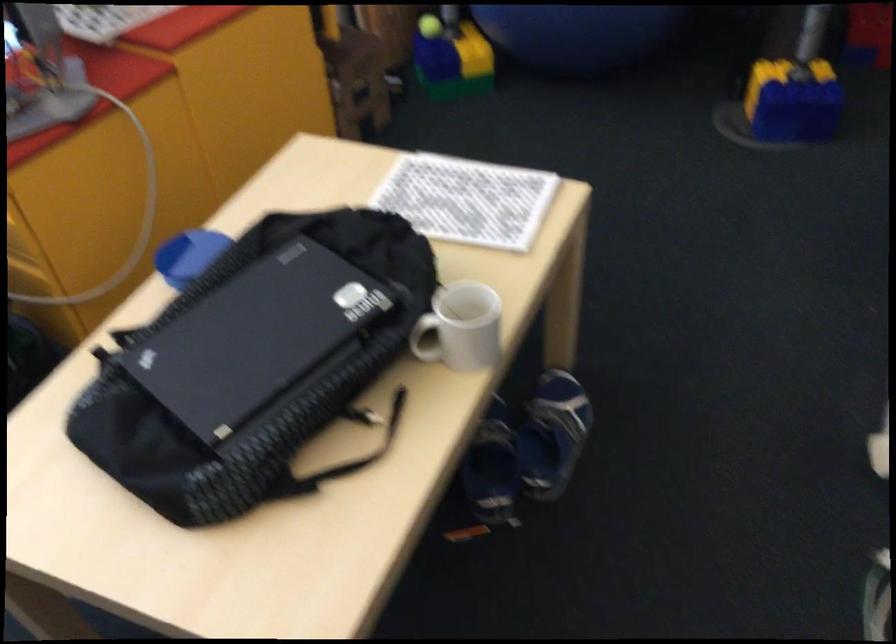
What do you see at coordinates (426, 339) in the screenshot?
I see `the white mug handle` at bounding box center [426, 339].